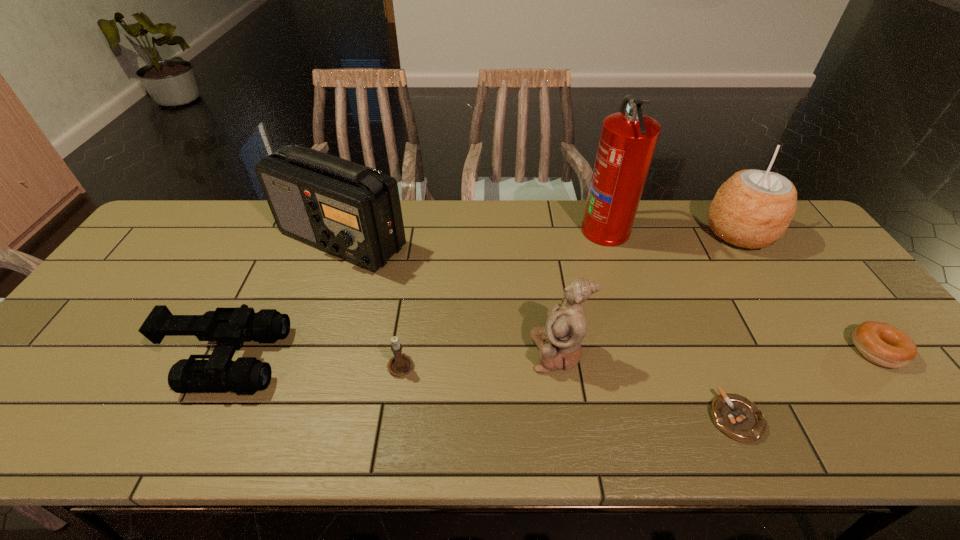
Locate an element on the screen. free space that is in between the bagel and the third shortest object is located at coordinates (638, 357).

Locate an element on the screen. This screenshot has width=960, height=540. free point between the third object from right to left and the figurine is located at coordinates (646, 385).

Image resolution: width=960 pixels, height=540 pixels. In order to click on unoccupied position between the coconut and the ashtray in this screenshot , I will do `click(737, 325)`.

Where is `free space between the figurine and the bagel`? free space between the figurine and the bagel is located at coordinates (717, 351).

Where is `object that stands as the sixth closest to the tallest object`? The width and height of the screenshot is (960, 540). object that stands as the sixth closest to the tallest object is located at coordinates (401, 364).

At what (x,y) coordinates should I click in order to perform the action: click on the fifth closest object to the candle holder. Please return your answer as a coordinate pair (x, y). Looking at the image, I should click on (736, 416).

In order to click on vacant region that satisfies the following two spatial constraints: 1. on the front panel of the radio receiver; 2. on the front lenses of the fourth shortest object in this screenshot , I will do `click(302, 359)`.

The height and width of the screenshot is (540, 960). Find the location of `free space in the image that satisfies the following two spatial constraints: 1. on the back side of the shortest object; 2. on the left side of the bagel`. free space in the image that satisfies the following two spatial constraints: 1. on the back side of the shortest object; 2. on the left side of the bagel is located at coordinates pyautogui.click(x=706, y=350).

In order to click on vacant region that satisfies the following two spatial constraints: 1. on the front side of the coconut; 2. on the front-facing side of the figurine in this screenshot , I will do `click(816, 352)`.